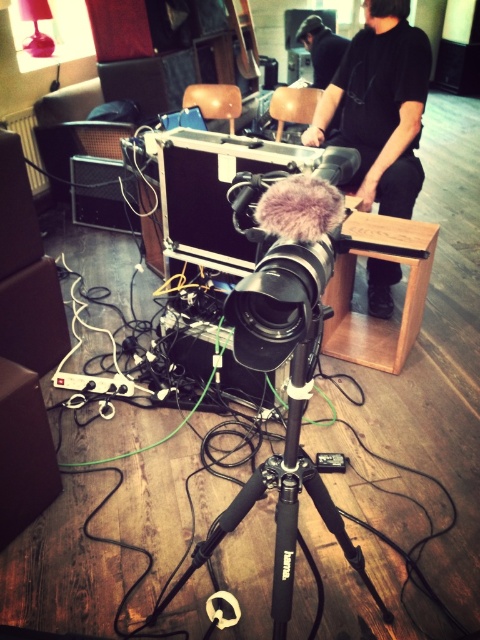
You are standing in the studio and want to move from point (408, 83) to point (241, 332). Which direction should you move to get closer to the camera?

You should move towards the point (241, 332) because it is closer to the camera than point (408, 83), which is further away.

You are an assistant setting up for a photoshoot. You need to ensure that the black matte camera at center is visible in the frame. Given that the black fabric shirt at upper center is currently blocking part of the camera, how can you adjust the setup to make the camera fully visible?

The black matte camera at center is positioned under the black fabric shirt at upper center. To make the camera fully visible, you can either lower the black fabric shirt at upper center or raise the camera to move it out from under the shirt.

You are standing in the studio and need to position a light source exactly at the center of the studio. Given the black matte camera at center is located at point 0.423, 0.596, can you determine whether the camera is positioned to the left or right of the studio center?

The black matte camera at center is located at point (286,269). Since the coordinates are given in a normalized system where (240,320) is the exact center, the camera is slightly to the left and above the studio center because its x coordinate is less than 0.5 and y coordinate is higher than 0.5.